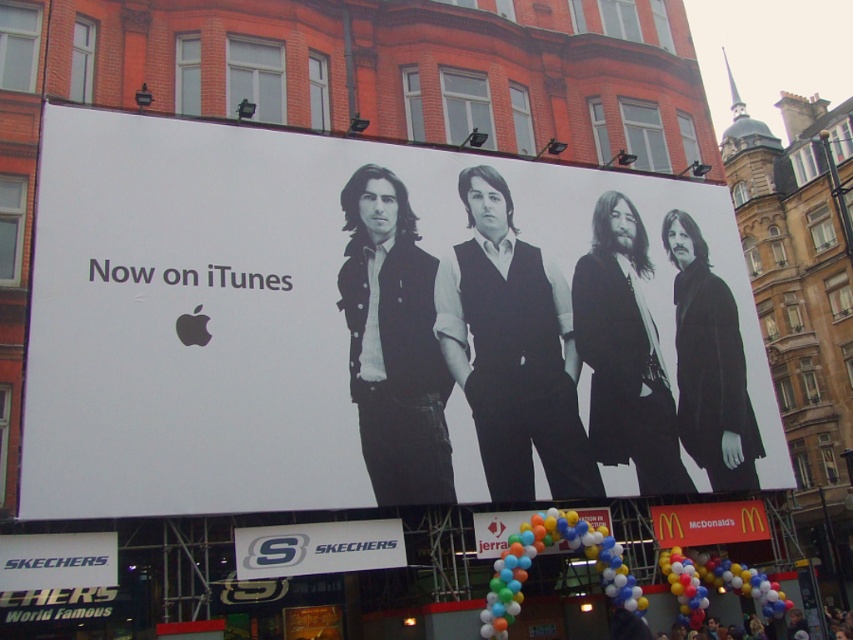
Question: Among these objects, which one is nearest to the camera?

Choices:
 (A) white plastic mcdonald's sign at lower right
 (B) white fabric sign at center
 (C) white paper billboard at center
 (D) balloon bouquet at lower center

Answer: (C)

Question: Which of the following is the farthest from the observer?

Choices:
 (A) (372, 561)
 (B) (517, 516)
 (C) (756, 540)

Answer: (C)

Question: Does white fabric sign at center have a lesser width compared to balloon bouquet at lower center?

Choices:
 (A) yes
 (B) no

Answer: (A)

Question: Which of the following is the closest to the observer?

Choices:
 (A) (738, 529)
 (B) (403, 545)
 (C) (473, 525)
 (D) (221, 141)

Answer: (B)

Question: Is white fabric sign at center smaller than white plastic mcdonald's sign at lower right?

Choices:
 (A) yes
 (B) no

Answer: (A)

Question: Observing the image, what is the correct spatial positioning of white fabric sign at center in reference to white plastic mcdonald's sign at lower right?

Choices:
 (A) right
 (B) left

Answer: (B)